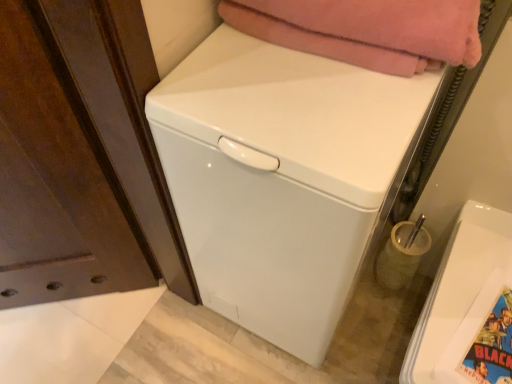
Where is `free area in between white glossy washing machine at center, positioned as the 2th washing machine in right-to-left order, and translucent glass toothbrush holder at lower right`? The image size is (512, 384). free area in between white glossy washing machine at center, positioned as the 2th washing machine in right-to-left order, and translucent glass toothbrush holder at lower right is located at coordinates (362, 316).